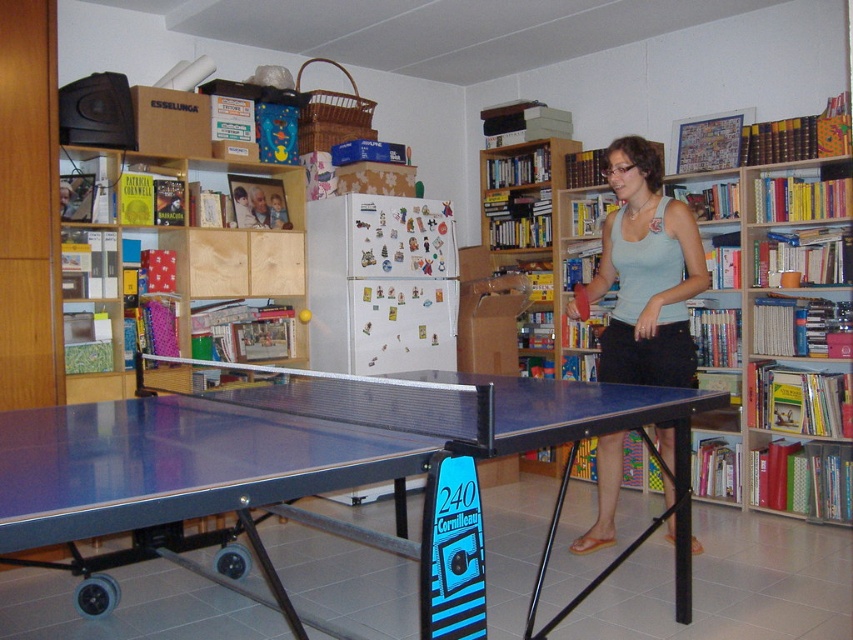
The image size is (853, 640). I want to click on blue glossy ping pong table at center, so click(x=318, y=468).

Is blue glossy ping pong table at center smaller than light blue tank top at center?

Actually, blue glossy ping pong table at center might be larger than light blue tank top at center.

Locate an element on the screen. The image size is (853, 640). blue glossy ping pong table at center is located at coordinates (318, 468).

Is blue glossy ping pong table at center to the right of wooden bookshelf at upper left from the viewer's perspective?

Yes, blue glossy ping pong table at center is to the right of wooden bookshelf at upper left.

Who is more forward, [160,493] or [212,276]?

Point [160,493] is in front.

Is point (677, 588) farther from viewer compared to point (231, 244)?

That is False.

At what (x,y) coordinates should I click in order to perform the action: click on blue glossy ping pong table at center. Please return your answer as a coordinate pair (x, y). This screenshot has width=853, height=640. Looking at the image, I should click on (318, 468).

Consider the image. Is light blue tank top at center below wooden bookshelf at upper left?

Yes, light blue tank top at center is below wooden bookshelf at upper left.

Can you confirm if light blue tank top at center is wider than wooden bookshelf at upper left?

No.

This screenshot has height=640, width=853. What do you see at coordinates (646, 273) in the screenshot?
I see `light blue tank top at center` at bounding box center [646, 273].

What are the coordinates of `light blue tank top at center` in the screenshot? It's located at (646, 273).